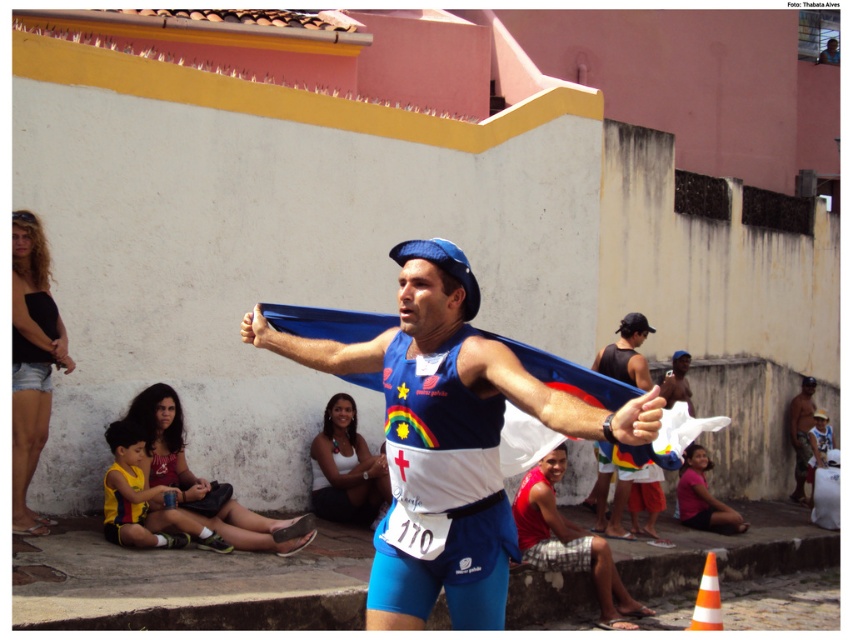
Question: Which point is closer to the camera?

Choices:
 (A) (606, 492)
 (B) (506, 422)

Answer: (B)

Question: Is blue fabric flag at center positioned behind orange striped traffic cone at lower right?

Choices:
 (A) yes
 (B) no

Answer: (B)

Question: Can you confirm if matte blue tank top at center is positioned above camouflage fabric shirt at right?

Choices:
 (A) no
 (B) yes

Answer: (A)

Question: Considering the real-world distances, which object is closest to the matte blue tank top at center?

Choices:
 (A) orange striped traffic cone at lower right
 (B) matte blue fabric at center
 (C) blue fabric flag at center

Answer: (A)

Question: Estimate the real-world distances between objects in this image. Which object is farther from the matte blue tank top at center?

Choices:
 (A) matte blue fabric at center
 (B) orange striped traffic cone at lower right
 (C) camouflage fabric shirt at right
 (D) red fabric at lower right

Answer: (A)

Question: Is blue fabric flag at center to the right of orange striped traffic cone at lower right from the viewer's perspective?

Choices:
 (A) no
 (B) yes

Answer: (A)